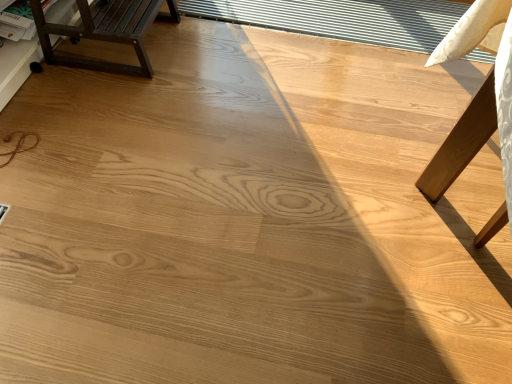
At what (x,y) coordinates should I click in order to perform the action: click on free spot to the right of matte dark brown wooden bench at upper left. Please return your answer as a coordinate pair (x, y). The image size is (512, 384). Looking at the image, I should click on (207, 57).